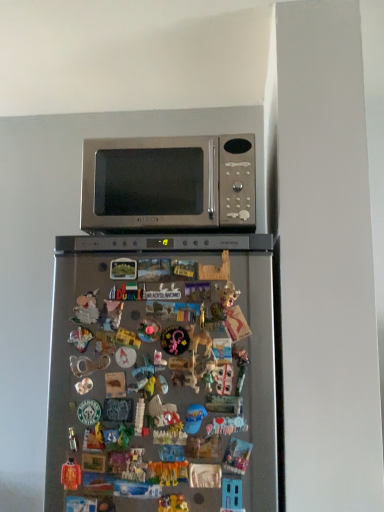
Question: Could you tell me if satin silver refrigerator at center is turned towards multicolored plastic toy at center, which ranks as the second toy in left-to-right order?

Choices:
 (A) yes
 (B) no

Answer: (A)

Question: Can you confirm if satin silver refrigerator at center is shorter than multicolored plastic toy at center, which ranks as the second toy in left-to-right order?

Choices:
 (A) no
 (B) yes

Answer: (A)

Question: From a real-world perspective, is satin silver refrigerator at center under multicolored plastic toy at center, which appears as the second toy when viewed from the right?

Choices:
 (A) no
 (B) yes

Answer: (A)

Question: Is satin silver refrigerator at center smaller than multicolored plastic toy at center, which appears as the second toy when viewed from the right?

Choices:
 (A) no
 (B) yes

Answer: (A)

Question: From a real-world perspective, is satin silver refrigerator at center on top of multicolored plastic toy at center, which appears as the second toy when viewed from the right?

Choices:
 (A) no
 (B) yes

Answer: (B)

Question: Does point (170, 466) appear closer or farther from the camera than point (168, 165)?

Choices:
 (A) farther
 (B) closer

Answer: (B)

Question: Considering their positions, is multicolored plastic toy at center, which ranks as the second toy in left-to-right order, located in front of or behind satin silver microwave at upper center?

Choices:
 (A) behind
 (B) front

Answer: (B)

Question: Considering the positions of multicolored plastic toy at center, which appears as the second toy when viewed from the right, and satin silver microwave at upper center in the image, is multicolored plastic toy at center, which appears as the second toy when viewed from the right, wider or thinner than satin silver microwave at upper center?

Choices:
 (A) thin
 (B) wide

Answer: (A)

Question: Considering the positions of multicolored plastic toy at center, which ranks as the second toy in left-to-right order, and satin silver microwave at upper center in the image, is multicolored plastic toy at center, which ranks as the second toy in left-to-right order, taller or shorter than satin silver microwave at upper center?

Choices:
 (A) tall
 (B) short

Answer: (B)

Question: From a real-world perspective, is matte orange toy at lower left, the third toy positioned from the right, physically located above or below plastic toy at center, arranged as the third toy when viewed from the left?

Choices:
 (A) above
 (B) below

Answer: (A)

Question: Considering the positions of matte orange toy at lower left, the third toy positioned from the right, and plastic toy at center, the 1th toy in the right-to-left sequence, in the image, is matte orange toy at lower left, the third toy positioned from the right, wider or thinner than plastic toy at center, the 1th toy in the right-to-left sequence,?

Choices:
 (A) wide
 (B) thin

Answer: (A)

Question: From their relative heights in the image, would you say matte orange toy at lower left, the third toy positioned from the right, is taller or shorter than plastic toy at center, arranged as the third toy when viewed from the left?

Choices:
 (A) tall
 (B) short

Answer: (A)

Question: Based on their positions, is matte orange toy at lower left, the third toy positioned from the right, located to the left or right of plastic toy at center, arranged as the third toy when viewed from the left?

Choices:
 (A) right
 (B) left

Answer: (B)

Question: Considering the positions of satin silver refrigerator at center and matte orange toy at lower left, the 1th toy viewed from the left, in the image, is satin silver refrigerator at center wider or thinner than matte orange toy at lower left, the 1th toy viewed from the left,?

Choices:
 (A) thin
 (B) wide

Answer: (B)

Question: From a real-world perspective, relative to matte orange toy at lower left, the third toy positioned from the right, is satin silver refrigerator at center vertically above or below?

Choices:
 (A) above
 (B) below

Answer: (A)